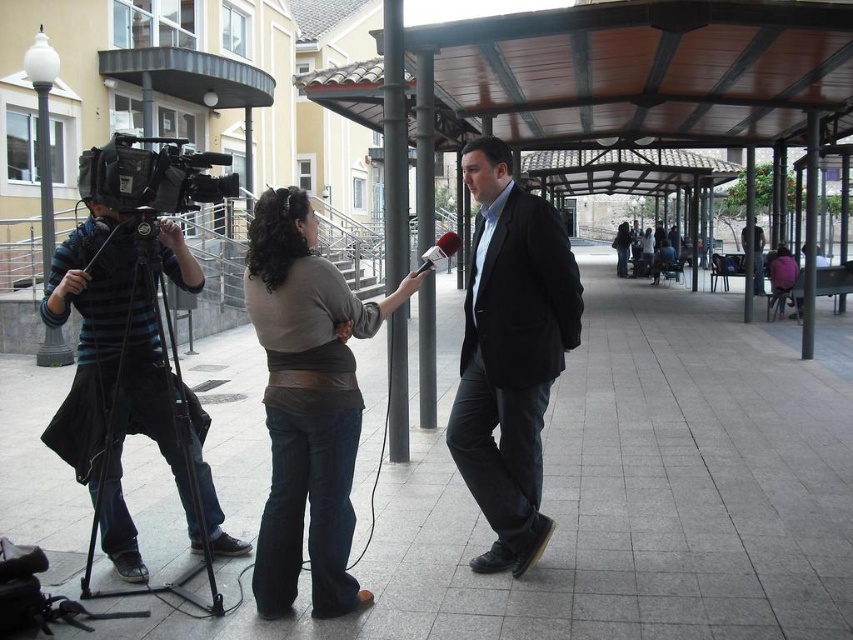
You are a photographer positioned behind the camera. You notice the brown leather jacket at center and the red fabric microphone at center in your frame. Which object should you focus on to ensure the closer one is sharp?

You should focus on the brown leather jacket at center because it is closer to the viewer than the red fabric microphone at center.

You are a photographer trying to set up your equipment for a news interview. You have a matte black suit at center and a black matte camera at left. Based on the scene, which object is positioned to the right of the other?

The matte black suit at center is positioned to the right of the black matte camera at left.

You are a photographer standing at the back of the walkway. You want to take a photo of the brown leather jacket at center and the red fabric microphone at center so that both are clearly visible. Which object should you focus on first to ensure the other remains in the frame?

The brown leather jacket at center is positioned under the red fabric microphone at center. Since the jacket is below the microphone, focusing on the microphone first will keep the jacket in the lower part of the frame, ensuring both are visible.